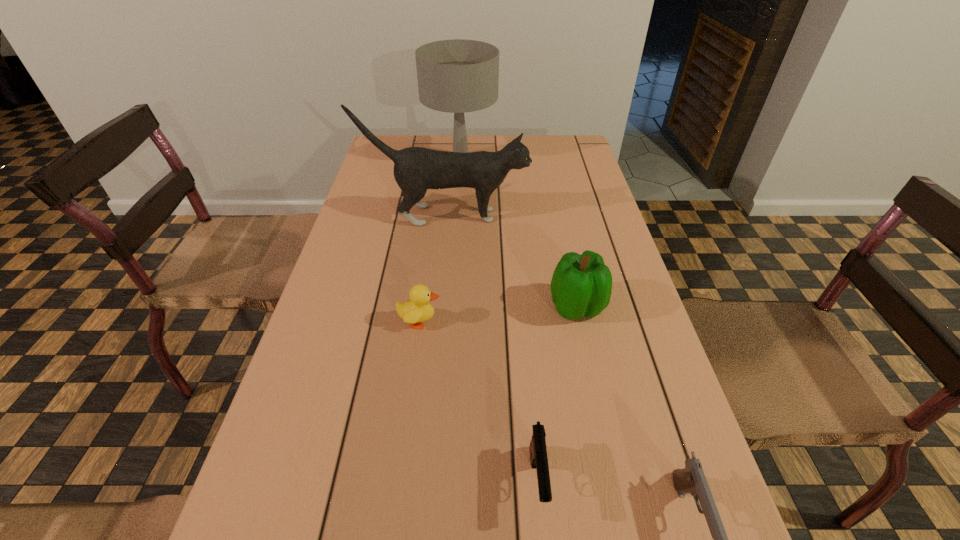
Identify the location of unoccupied position between the farthest object and the duckling. This screenshot has width=960, height=540. (441, 240).

The height and width of the screenshot is (540, 960). I want to click on blank region between the bell pepper and the duckling, so click(x=498, y=314).

This screenshot has width=960, height=540. In order to click on free space between the bell pepper and the left pistol in this screenshot , I will do `click(557, 394)`.

I want to click on vacant area that lies between the fifth object from left to right and the left pistol, so click(x=557, y=394).

Identify which object is located as the nearest to the duckling. Please provide its 2D coordinates. Your answer should be formatted as a tuple, i.e. [(x, y)], where the tuple contains the x and y coordinates of a point satisfying the conditions above.

[(581, 285)]

Where is `object that stands as the fifth closest to the farthest object`? object that stands as the fifth closest to the farthest object is located at coordinates (691, 479).

The image size is (960, 540). In order to click on vacant region that satisfies the following two spatial constraints: 1. at the face of the cat; 2. on the back side of the fourth shortest object in this screenshot , I will do `click(437, 307)`.

The height and width of the screenshot is (540, 960). What are the coordinates of `vacant point that satisfies the following two spatial constraints: 1. on the front-facing side of the farthest object; 2. on the left side of the bell pepper` in the screenshot? It's located at (450, 307).

Where is `blank area in the image that satisfies the following two spatial constraints: 1. on the front-facing side of the lampshade; 2. on the left side of the second object from right to left`? The image size is (960, 540). blank area in the image that satisfies the following two spatial constraints: 1. on the front-facing side of the lampshade; 2. on the left side of the second object from right to left is located at coordinates (450, 307).

The image size is (960, 540). Find the location of `free space that satisfies the following two spatial constraints: 1. on the front-facing side of the lampshade; 2. on the back side of the second object from right to left`. free space that satisfies the following two spatial constraints: 1. on the front-facing side of the lampshade; 2. on the back side of the second object from right to left is located at coordinates (450, 307).